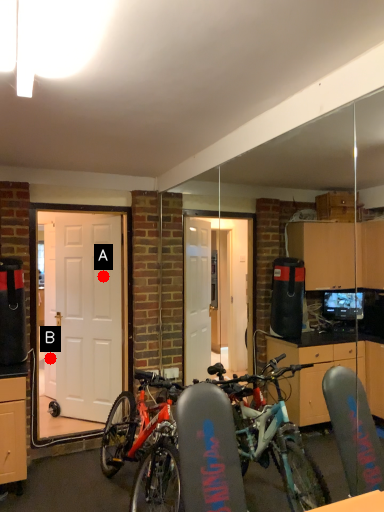
Question: Two points are circled on the image, labeled by A and B beside each circle. Which point appears closest to the camera in this image?

Choices:
 (A) A is closer
 (B) B is closer

Answer: (A)